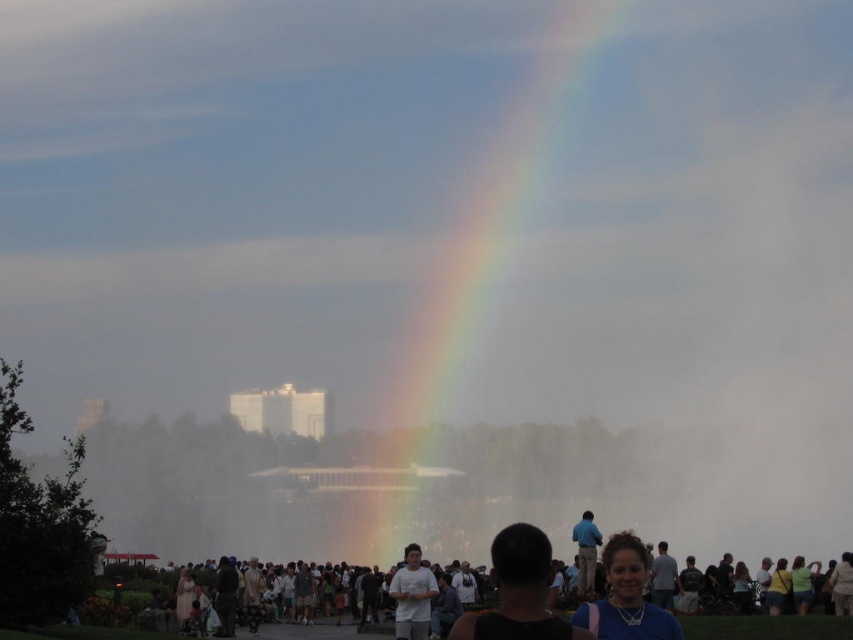
Question: Which object appears closest to the camera in this image?

Choices:
 (A) blue cotton shirt at center
 (B) white matte shirt at center
 (C) matte white people at lower center
 (D) rainbow at center

Answer: (C)

Question: Which object is farther from the camera taking this photo?

Choices:
 (A) matte blue necklace at lower right
 (B) matte white people at lower center

Answer: (B)

Question: Estimate the real-world distances between objects in this image. Which object is farther from the matte blue necklace at lower right?

Choices:
 (A) blue cotton shirt at center
 (B) black hair at center
 (C) white matte shirt at center
 (D) rainbow at center

Answer: (D)

Question: Observing the image, what is the correct spatial positioning of matte blue necklace at lower right in reference to blue cotton shirt at center?

Choices:
 (A) right
 (B) left

Answer: (A)

Question: Is matte blue necklace at lower right wider than blue cotton shirt at center?

Choices:
 (A) yes
 (B) no

Answer: (A)

Question: Does matte white people at lower center have a larger size compared to blue cotton shirt at center?

Choices:
 (A) no
 (B) yes

Answer: (B)